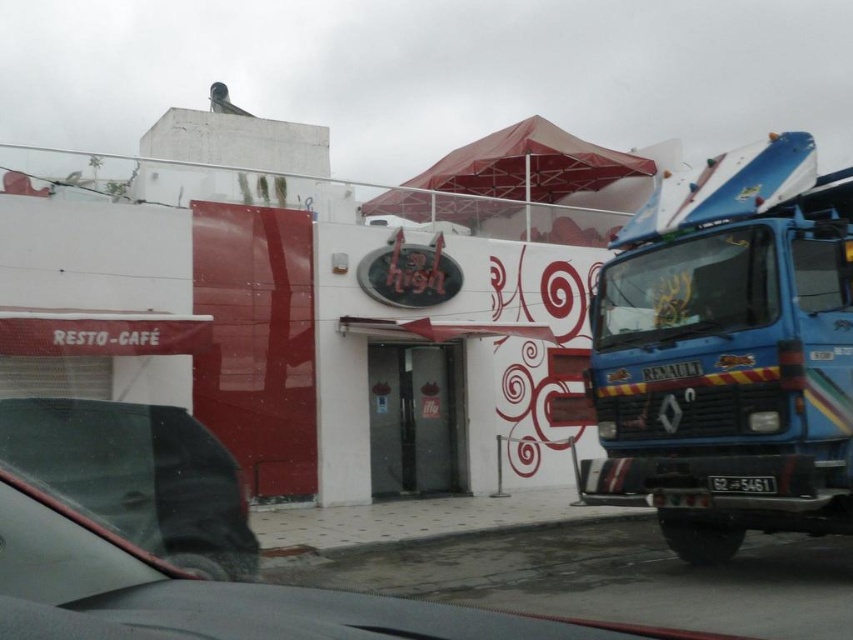
You are a delivery person who needs to park your 16 feet long truck. You see the blue metallic truck at right and the matte black car at lower left. Is there enough space between them to park your truck?

The blue metallic truck at right and the matte black car at lower left are 15.51 feet apart. Since your truck is 16 feet long, there isn not enough space between them to park your truck.

You are standing in front of the RESTO CAF building and see a point marked at coordinates (729, 349). What object does this point correspond to?

The point corresponds to the blue metallic truck at right.

You are a pedestrian standing on the sidewalk in front of the RESTO CAF building. You see the blue metallic truck at right and the black plastic license plate at center. Which object is closer to you?

The blue metallic truck at right is closer to you than the black plastic license plate at center because it is further to the viewer.